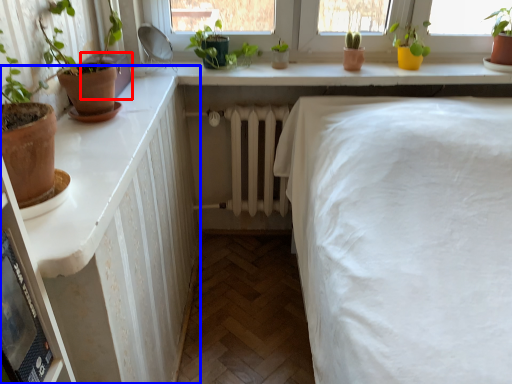
Question: Which of the following is the farthest to the observer, window box (highlighted by a red box) or dresser (highlighted by a blue box)?

Choices:
 (A) window box
 (B) dresser

Answer: (A)